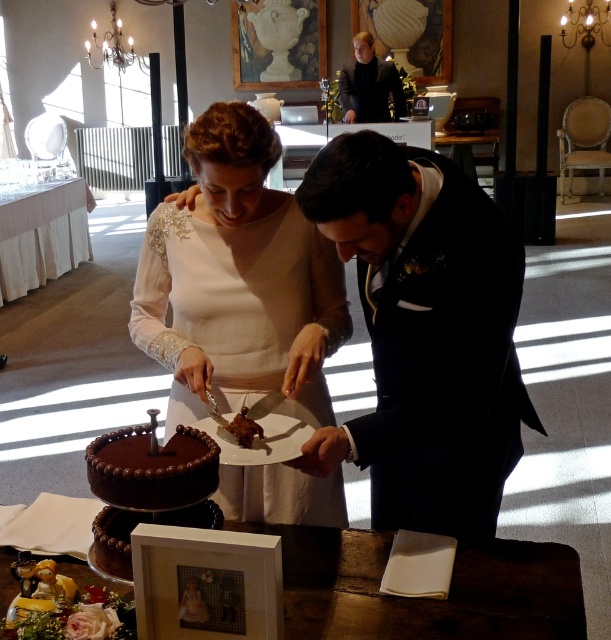
You are a photographer at the wedding and need to position yourself to capture the couple cutting the cake. The black satin suit at center and wooden table at center are in the scene. Which object should you place closer to the camera to ensure the couple is in focus?

To ensure the couple is in focus, you should place the black satin suit at center closer to the camera since the wooden table at center is behind it, meaning the suit is nearer to the photographer.

You are a photographer at the wedding and want to capture a photo where both the matte white dress at center and the chocolatesmoothwedding cake at center are clearly visible. Since the dress is larger, where should you position the camera to ensure both are in frame?

Since the matte white dress at center is larger than the chocolatesmoothwedding cake at center, positioning the camera slightly closer to the cake would help balance their sizes in the photo, ensuring both are clearly visible.

You are a photographer at the wedding and need to capture a closeup shot of both the black satin suit at center and the matte white dress at center. What is the minimum distance you need to adjust your camera lens to focus on both subjects simultaneously?

The minimum distance required is 12.36 inches, as the black satin suit at center is 12.36 inches away from the matte white dress at center.